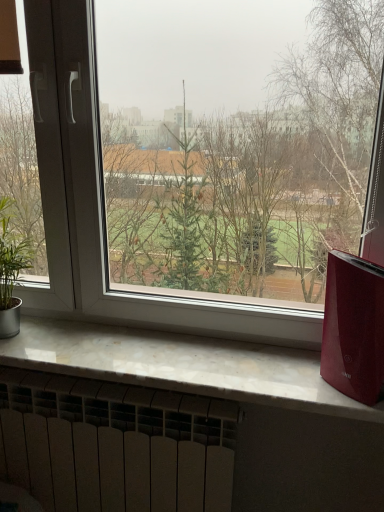
Identify the location of free space that is in between green leafy plant at left and shiny red air purifier at right. The height and width of the screenshot is (512, 384). (178, 368).